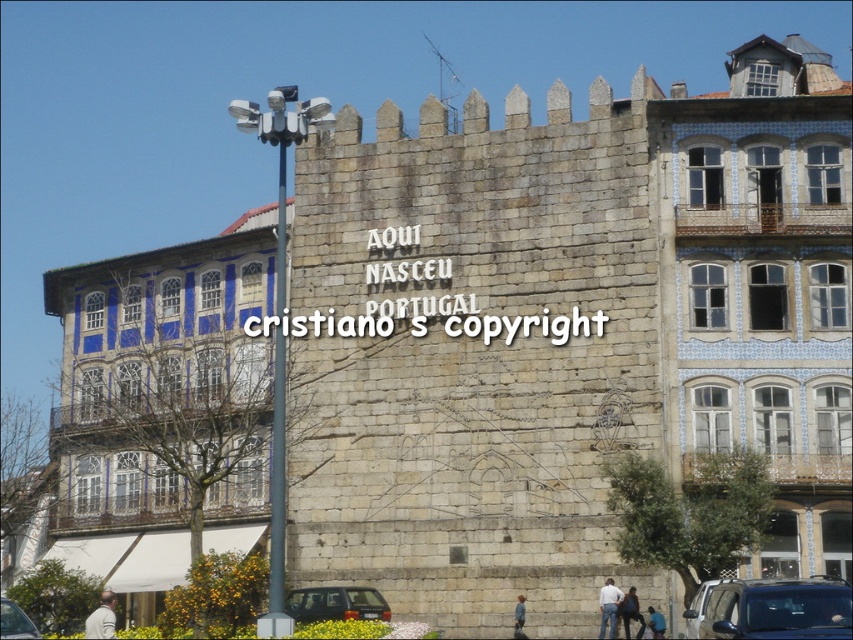
Question: Is metallic silver car at lower left closer to camera compared to white cotton shirt at center?

Choices:
 (A) yes
 (B) no

Answer: (A)

Question: Estimate the real-world distances between objects in this image. Which object is closer to the blue fabric shirt at lower center?

Choices:
 (A) metallic silver car at lower left
 (B) dark brown matte car at center
 (C) light blue fabric at center

Answer: (C)

Question: Based on their relative distances, which object is farther from the blue fabric shirt at lower center?

Choices:
 (A) dark brown matte car at center
 (B) metallic silver car at lower left
 (C) light blue fabric at center
 (D) dark blue jeans at lower center

Answer: (B)

Question: Is metallic silver car at lower right wider than blue fabric shirt at lower center?

Choices:
 (A) no
 (B) yes

Answer: (B)

Question: Can you confirm if dark brown matte car at center is positioned below light beige fabric jacket at lower left?

Choices:
 (A) yes
 (B) no

Answer: (B)

Question: Which object appears farthest from the camera in this image?

Choices:
 (A) dark brown matte car at center
 (B) light beige fabric jacket at lower left

Answer: (A)